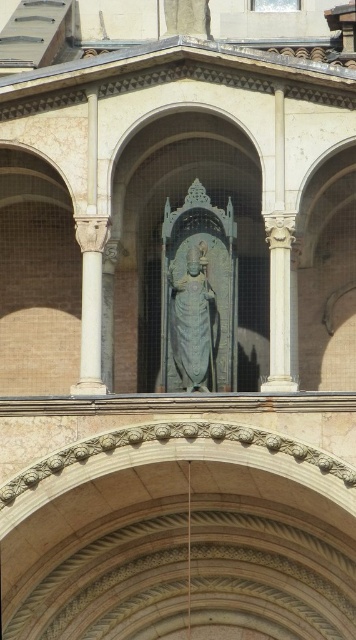
You are an architect planning to install a new lighting fixture between the gray stone statue at center and the white marble column at right. The fixture requires a minimum of 6 meters of space between them to be installed safely. Based on the distance provided, can the lighting fixture be installed between these two objects?

The gray stone statue at center is 5.86 meters from the white marble column at right. Since the required minimum distance for the lighting fixture is 6 meters, the current space is insufficient. Therefore, the lighting fixture cannot be installed between them safely.

You are standing in front of the historical building shown in the image. You want to take a photo of the gray stone statue at center. Where should you position yourself to ensure the statue is centered in your camera viewfinder?

To center the gray stone statue at center in your camera viewfinder, position yourself directly in front of the statue at its 2D coordinates point (190, 321) as specified in the scene description.

You are an architect assessing the space between the gray stone statue at center and the white marble column at right. If the statue is narrower than the column, will it fit through a doorway that is the same width as the column?

The gray stone statue at center has a lesser width compared to white marble column at right, so yes, the statue can fit through a doorway that is the same width as the column since it is narrower than the column.